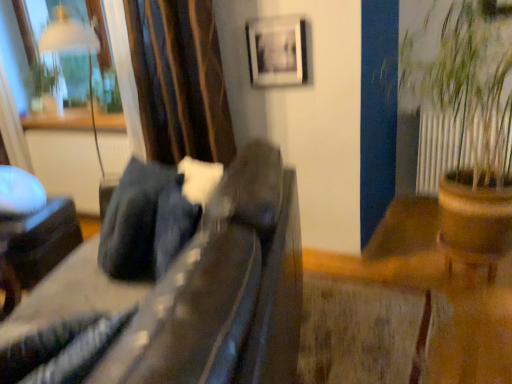
Question: Is transparent glass window at upper left placed right next to brown wooden pot at right?

Choices:
 (A) yes
 (B) no

Answer: (B)

Question: From the image's perspective, would you say transparent glass window at upper left is shown under brown wooden pot at right?

Choices:
 (A) no
 (B) yes

Answer: (A)

Question: Is transparent glass window at upper left at the right side of brown wooden pot at right?

Choices:
 (A) yes
 (B) no

Answer: (B)

Question: From a real-world perspective, is transparent glass window at upper left located beneath brown wooden pot at right?

Choices:
 (A) yes
 (B) no

Answer: (B)

Question: Considering the relative positions of transparent glass window at upper left and brown wooden pot at right in the image provided, is transparent glass window at upper left behind brown wooden pot at right?

Choices:
 (A) no
 (B) yes

Answer: (B)

Question: In terms of width, does transparent glass window at upper left look wider or thinner when compared to velvet-like brown curtain at upper left?

Choices:
 (A) thin
 (B) wide

Answer: (B)

Question: Do you think transparent glass window at upper left is within velvet-like brown curtain at upper left, or outside of it?

Choices:
 (A) outside
 (B) inside

Answer: (A)

Question: Is transparent glass window at upper left taller or shorter than velvet-like brown curtain at upper left?

Choices:
 (A) short
 (B) tall

Answer: (A)

Question: In the image, is transparent glass window at upper left on the left side or the right side of velvet-like brown curtain at upper left?

Choices:
 (A) left
 (B) right

Answer: (A)

Question: Considering the positions of point (505, 178) and point (117, 105), is point (505, 178) closer or farther from the camera than point (117, 105)?

Choices:
 (A) closer
 (B) farther

Answer: (A)

Question: From a real-world perspective, relative to transparent glass window at upper left, is brown wooden pot at right vertically above or below?

Choices:
 (A) above
 (B) below

Answer: (B)

Question: From the image's perspective, is brown wooden pot at right located above or below transparent glass window at upper left?

Choices:
 (A) above
 (B) below

Answer: (B)

Question: Considering their positions, is brown wooden pot at right located in front of or behind transparent glass window at upper left?

Choices:
 (A) behind
 (B) front

Answer: (B)

Question: Would you say velvet-like brown curtain at upper left is inside or outside brown wooden pot at right?

Choices:
 (A) inside
 (B) outside

Answer: (B)

Question: From the image's perspective, is velvet-like brown curtain at upper left positioned above or below brown wooden pot at right?

Choices:
 (A) above
 (B) below

Answer: (A)